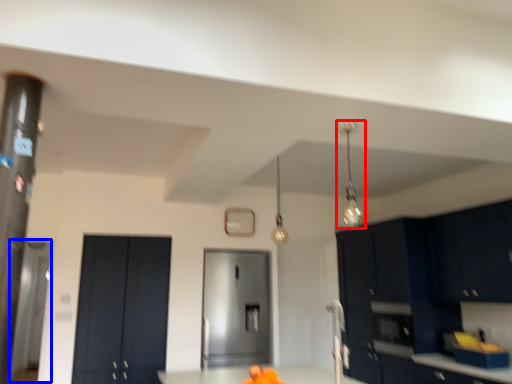
Question: Which of the following is the farthest to the observer, light fixture (highlighted by a red box) or glass door (highlighted by a blue box)?

Choices:
 (A) light fixture
 (B) glass door

Answer: (B)